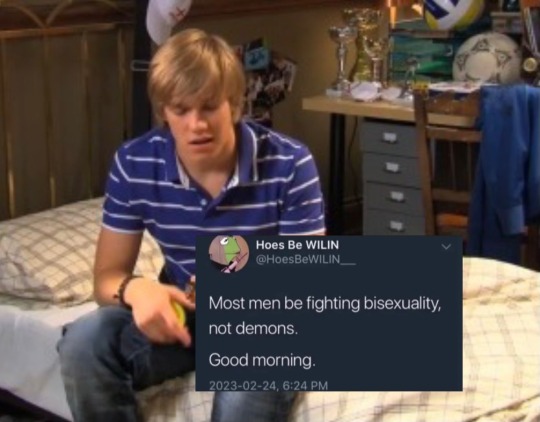
Where is `chair`? The height and width of the screenshot is (422, 540). chair is located at coordinates (451, 198), (456, 228), (426, 180).